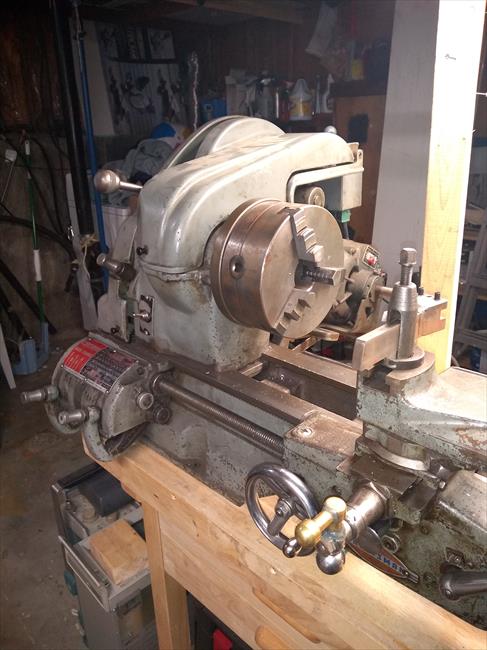
Where is `wooden table`? Image resolution: width=487 pixels, height=650 pixels. wooden table is located at coordinates (274, 584).